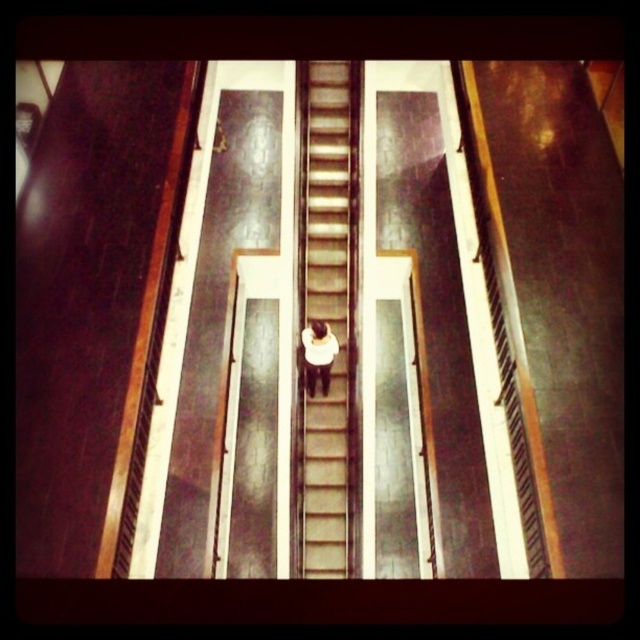
You are standing at the bottom of the staircase and want to reach the top. There are two points marked on the staircase, point 1 at coordinates [310,301] and point 2 at coordinates [312,368]. Which point is closer to you as you start climbing?

Point 1 at coordinates [310,301] is closer to you as you start climbing because it is further to the camera than point 2 at coordinates [312,368], indicating it is nearer to the bottom of the staircase.